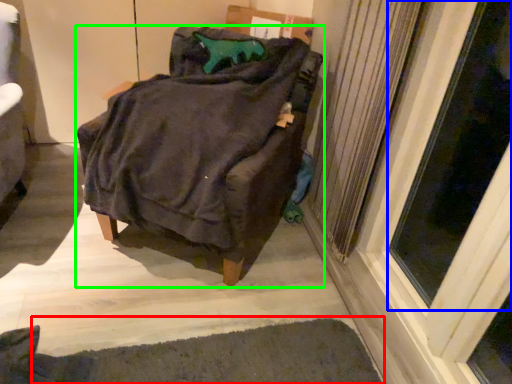
Question: Which object is positioned closest to doormat (highlighted by a red box)? Select from screen door (highlighted by a blue box) and furniture (highlighted by a green box).

Choices:
 (A) screen door
 (B) furniture

Answer: (B)